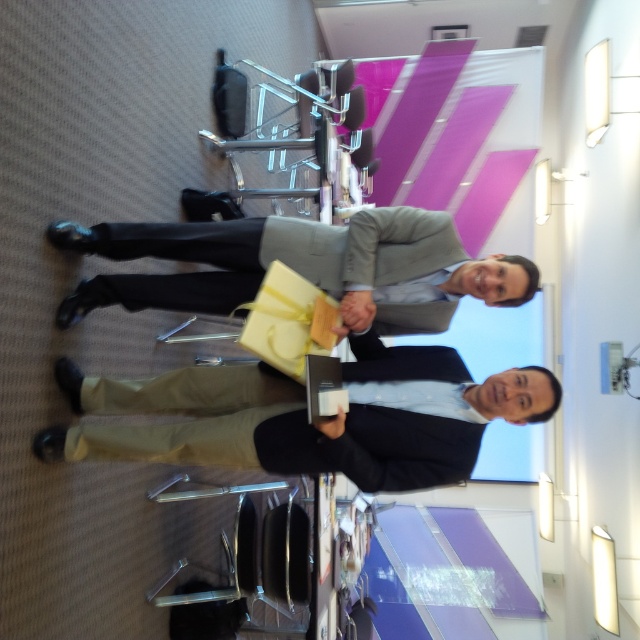
Question: Which point is closer to the camera?

Choices:
 (A) (246, 268)
 (B) (512, 417)

Answer: (B)

Question: Does matte black book at lower center have a larger size compared to matte gray suit at center?

Choices:
 (A) no
 (B) yes

Answer: (B)

Question: Is matte black book at lower center positioned at the back of matte gray suit at center?

Choices:
 (A) no
 (B) yes

Answer: (A)

Question: Does matte black book at lower center have a greater width compared to matte gray suit at center?

Choices:
 (A) no
 (B) yes

Answer: (B)